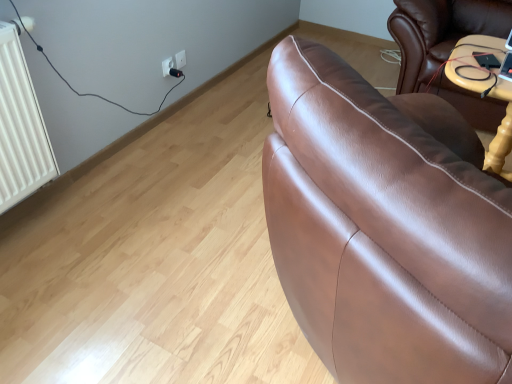
Question: In the image, is white plastic socket at upper center, which is the 1th electric outlet from left to right, positioned in front of or behind white plastic socket at upper left, acting as the 1th electric outlet starting from the right?

Choices:
 (A) front
 (B) behind

Answer: (A)

Question: Based on their positions, is white plastic socket at upper center, the second electric outlet when ordered from right to left, located to the left or right of white plastic socket at upper left, the second electric outlet positioned from the left?

Choices:
 (A) right
 (B) left

Answer: (B)

Question: Considering the real-world distances, which object is farthest from the white plastic socket at upper left, the second electric outlet positioned from the left?

Choices:
 (A) black plastic plug at upper center
 (B) white plastic socket at upper center, which is the 1th electric outlet from left to right

Answer: (B)

Question: Which of these objects is positioned closest to the black plastic plug at upper center?

Choices:
 (A) white plastic socket at upper left, acting as the 1th electric outlet starting from the right
 (B) white plastic socket at upper center, the second electric outlet when ordered from right to left

Answer: (A)